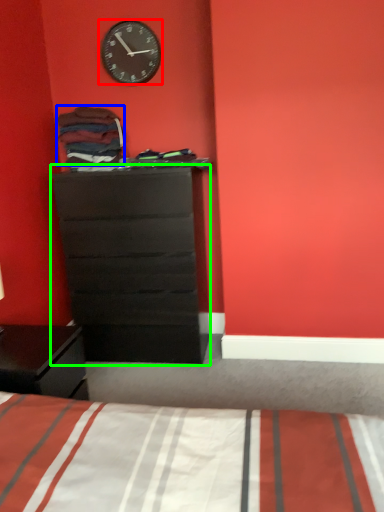
Question: Which is nearer to the wall clock (highlighted by a red box)? clothing (highlighted by a blue box) or chest of drawers (highlighted by a green box).

Choices:
 (A) clothing
 (B) chest of drawers

Answer: (A)